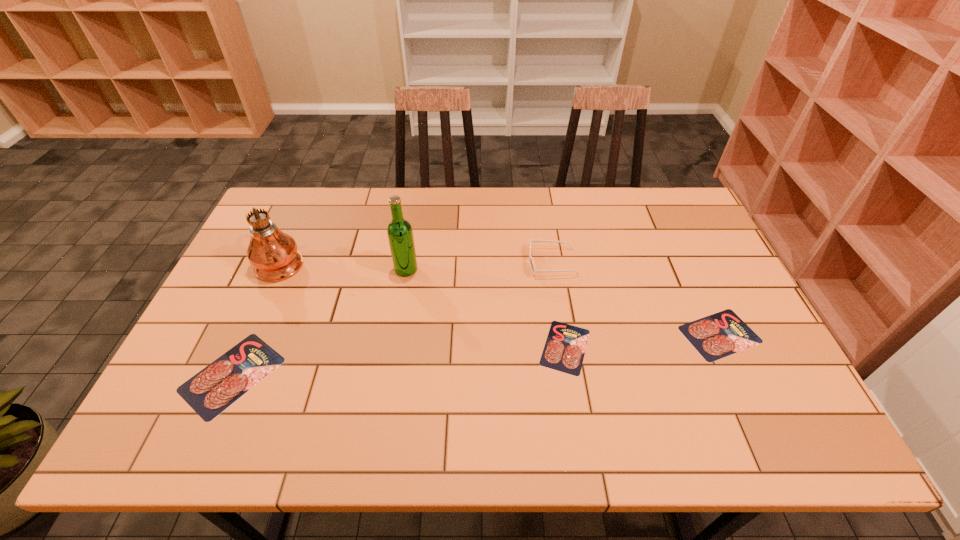
Identify the location of the leftmost salami. This screenshot has width=960, height=540. (212, 390).

Where is `the shortest object`? the shortest object is located at coordinates (564, 350).

Where is `the shortest salami`? The image size is (960, 540). the shortest salami is located at coordinates (564, 350).

The image size is (960, 540). I want to click on the second tallest salami, so click(x=716, y=336).

Where is `the rightmost salami`? The image size is (960, 540). the rightmost salami is located at coordinates (716, 336).

I want to click on the third object from left to right, so click(x=400, y=234).

Locate an element on the screen. the second tallest object is located at coordinates (400, 234).

Identify the location of the third tallest object. (532, 265).

Identify the location of oil lamp. (273, 253).

Locate an element on the screen. This screenshot has width=960, height=540. free space located on the right of the leftmost salami is located at coordinates (416, 375).